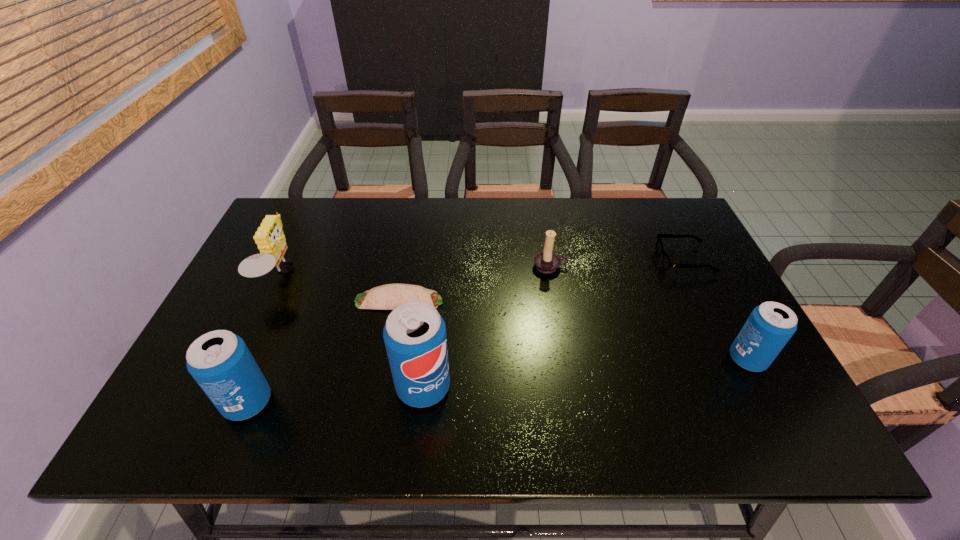
Locate an element on the screen. This screenshot has width=960, height=540. vacant spot for a new pop_(soda) to ensure equal spacing is located at coordinates (589, 373).